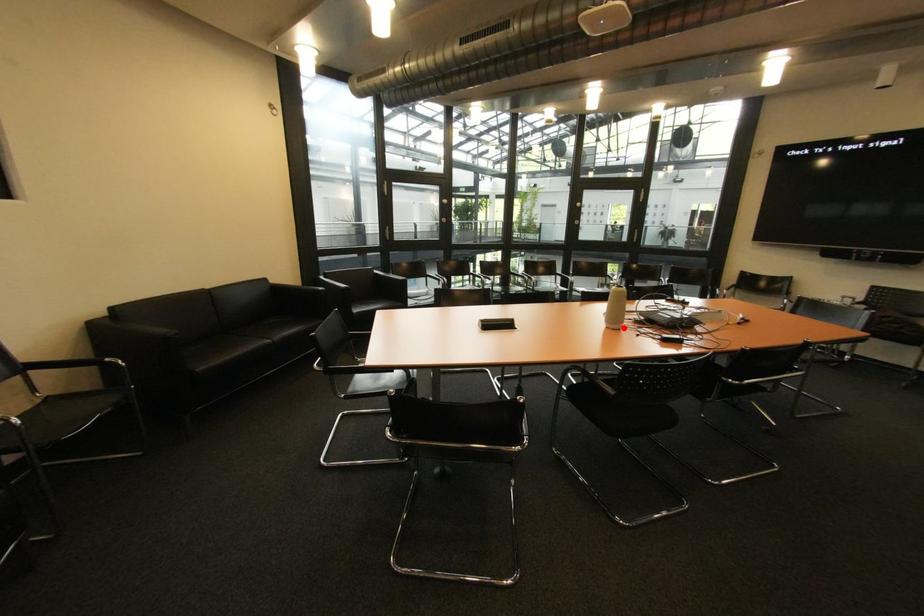
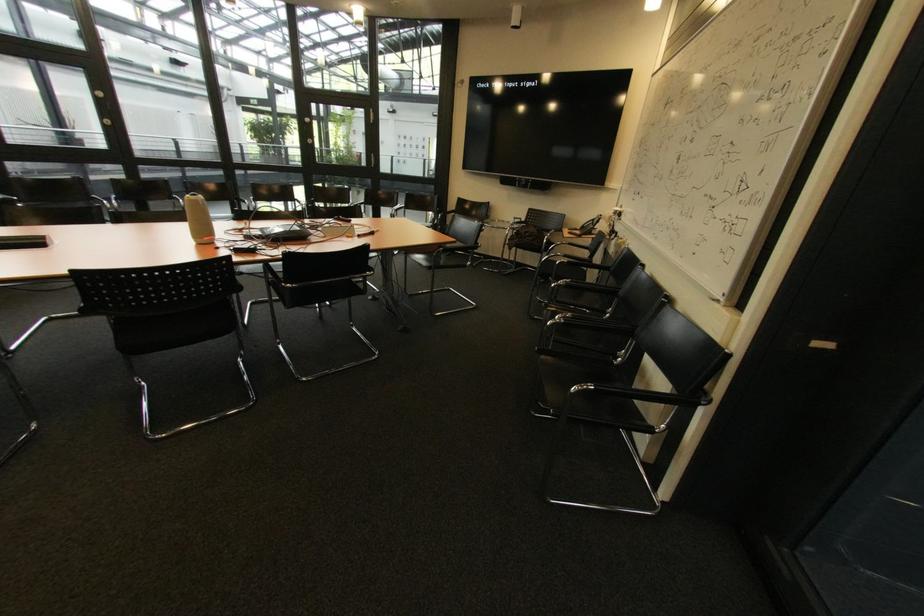
The point at the highlighted location is marked in the first image. Where is the corresponding point in the second image?

(210, 243)